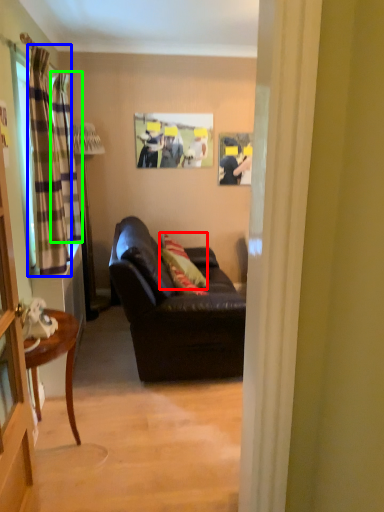
Question: Which is nearer to the pillow (highlighted by a red box)? curtain (highlighted by a blue box) or curtain (highlighted by a green box).

Choices:
 (A) curtain
 (B) curtain

Answer: (B)